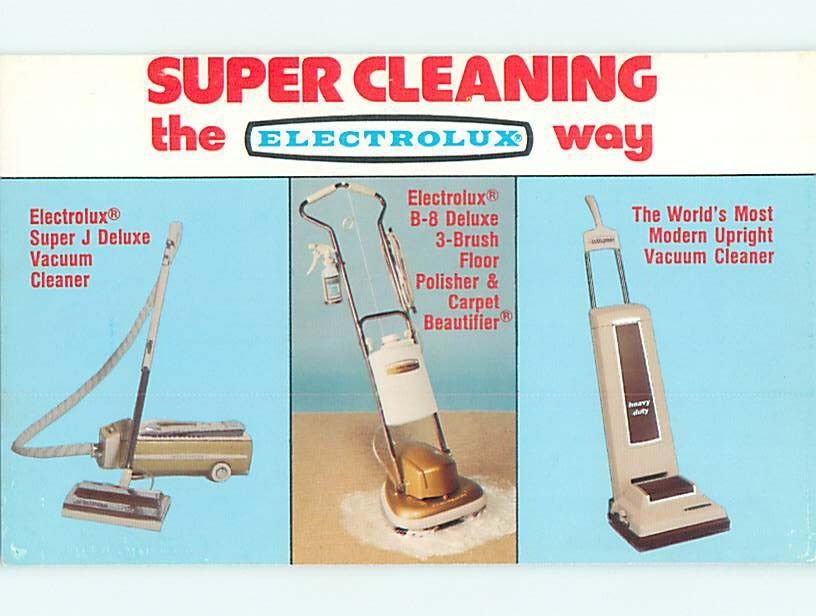
I want to click on floor, so click(120, 495).